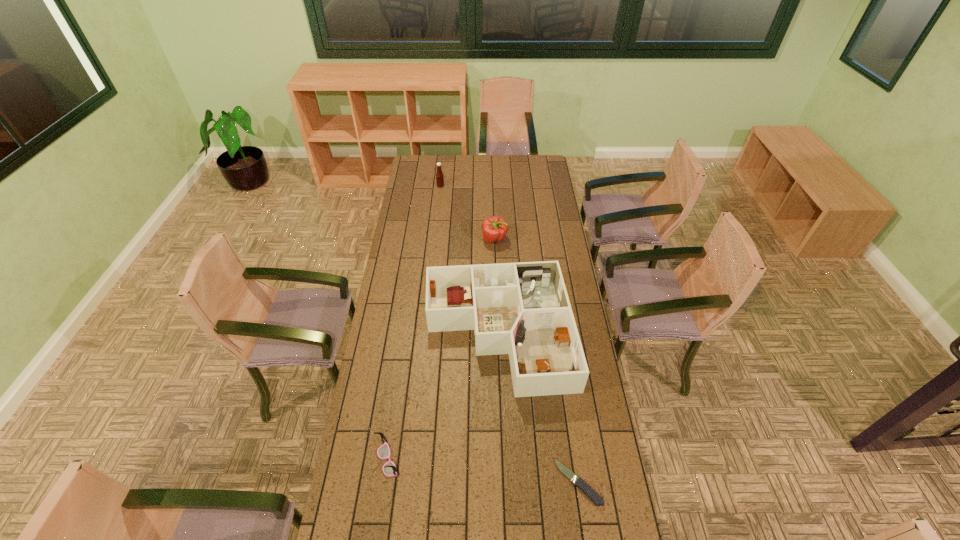
Identify the location of free spot between the Tabasco sauce and the third nearest object. (469, 260).

Find the location of a particular element. vacant space that's between the third nearest object and the Tabasco sauce is located at coordinates (469, 260).

The width and height of the screenshot is (960, 540). Identify the location of vacant space in between the third nearest object and the Tabasco sauce. (469, 260).

In order to click on vacant area between the farthest object and the second shortest object in this screenshot , I will do `click(414, 323)`.

Locate an element on the screen. object that is the fourth nearest to the dollhouse is located at coordinates (439, 175).

Locate which object is the second closest to the shortest object. Please provide its 2D coordinates. Your answer should be formatted as a tuple, i.e. [(x, y)], where the tuple contains the x and y coordinates of a point satisfying the conditions above.

[(389, 469)]

Where is `free spot that satisfies the following two spatial constraints: 1. on the front side of the farthest object; 2. on the right side of the bell pepper`? free spot that satisfies the following two spatial constraints: 1. on the front side of the farthest object; 2. on the right side of the bell pepper is located at coordinates (435, 239).

Find the location of a particular element. free spot that satisfies the following two spatial constraints: 1. on the front side of the shortest object; 2. on the left side of the leftmost object is located at coordinates (385, 482).

Find the location of a particular element. blank space that satisfies the following two spatial constraints: 1. on the front side of the steak knife; 2. on the left side of the third farthest object is located at coordinates (503, 482).

Where is `free space that satisfies the following two spatial constraints: 1. on the front side of the steak knife; 2. on the left side of the fourth nearest object`? free space that satisfies the following two spatial constraints: 1. on the front side of the steak knife; 2. on the left side of the fourth nearest object is located at coordinates (503, 482).